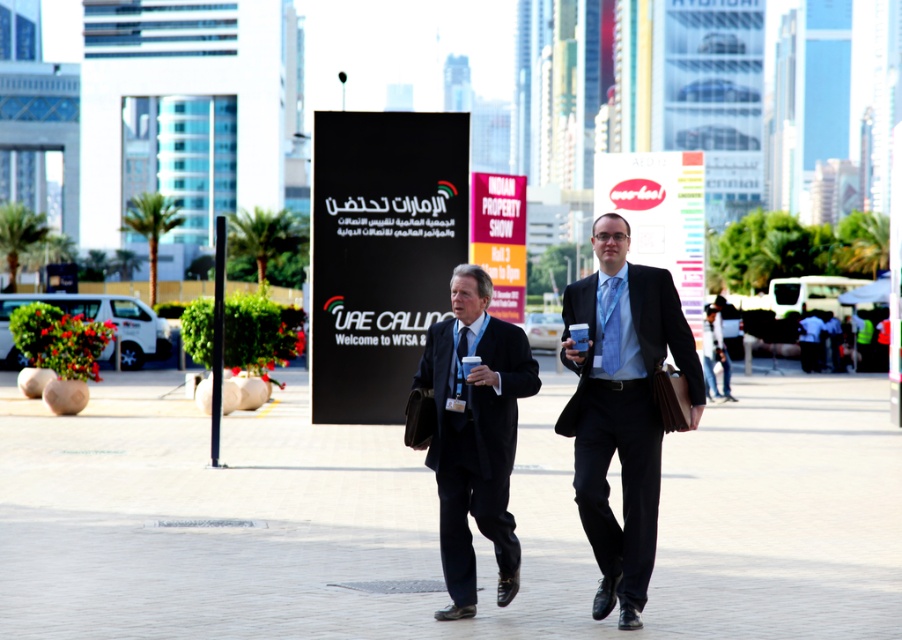
Question: Which point is farther to the camera?

Choices:
 (A) (482, 221)
 (B) (682, 276)

Answer: (A)

Question: Can you confirm if matte black suit at center is thinner than matte pink sign at center?

Choices:
 (A) yes
 (B) no

Answer: (A)

Question: Which of the following is the closest to the observer?

Choices:
 (A) matte pink sign at center
 (B) matte white sign at center

Answer: (B)

Question: Considering the relative positions of black plastic sign at center and matte white sign at center in the image provided, where is black plastic sign at center located with respect to matte white sign at center?

Choices:
 (A) left
 (B) right

Answer: (A)

Question: Is the position of matte black suit at center more distant than that of matte white sign at center?

Choices:
 (A) no
 (B) yes

Answer: (A)

Question: Which of the following is the closest to the observer?

Choices:
 (A) black suit at center
 (B) matte black suit at center
 (C) matte white sign at center

Answer: (B)